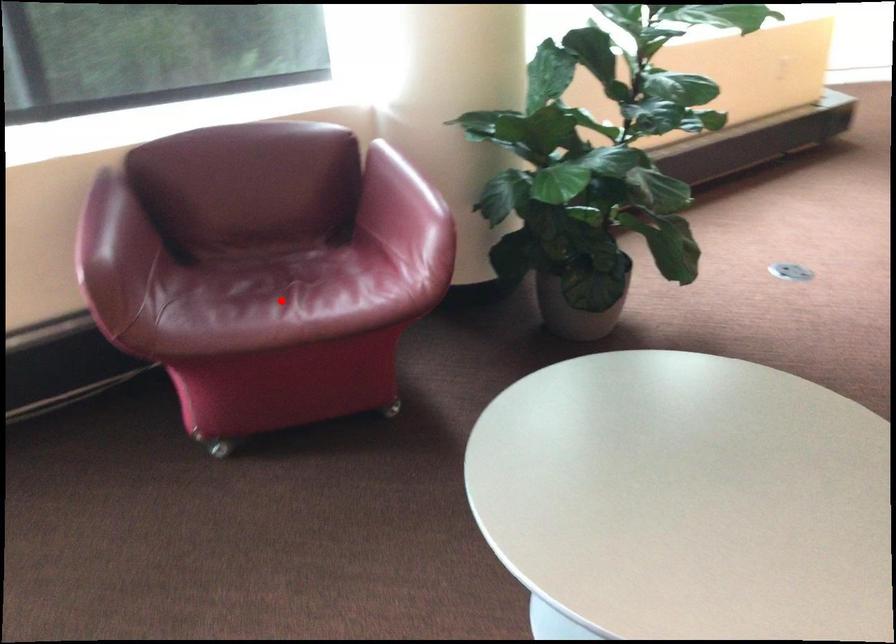
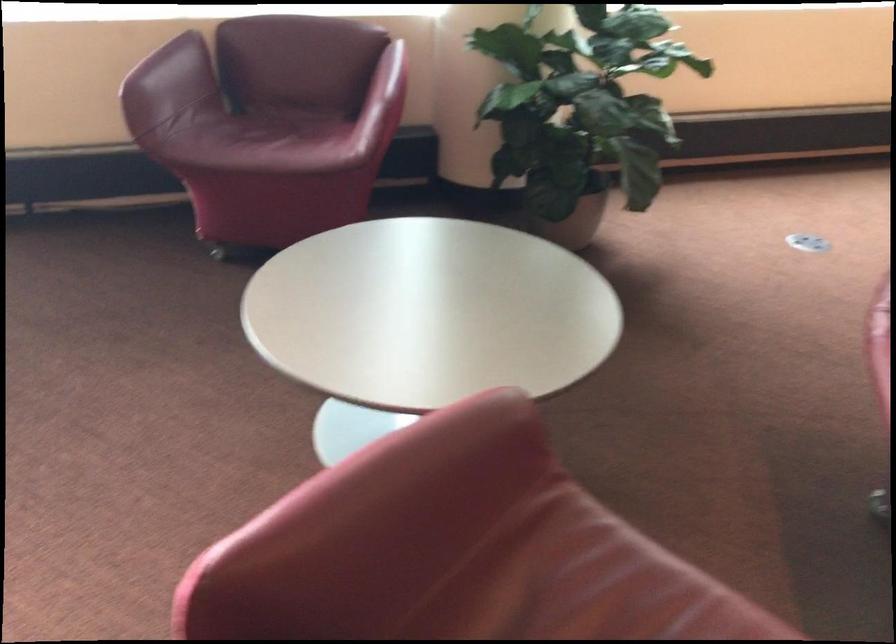
Question: I am providing you with two images of the same scene from different viewpoints. A red point is shown in image1. For the corresponding object point in image2, is it positioned nearer or farther from the camera?

Choices:
 (A) Nearer
 (B) Farther

Answer: (B)